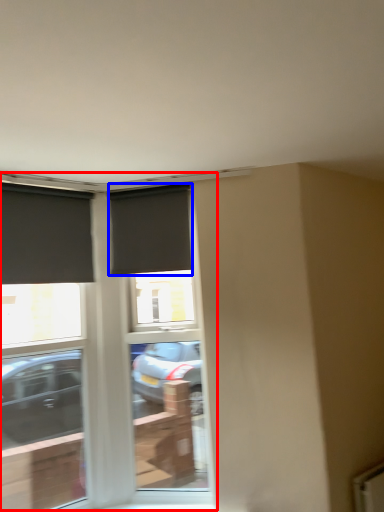
Question: Which point is further to the camera, window (highlighted by a red box) or window (highlighted by a blue box)?

Choices:
 (A) window
 (B) window

Answer: (B)